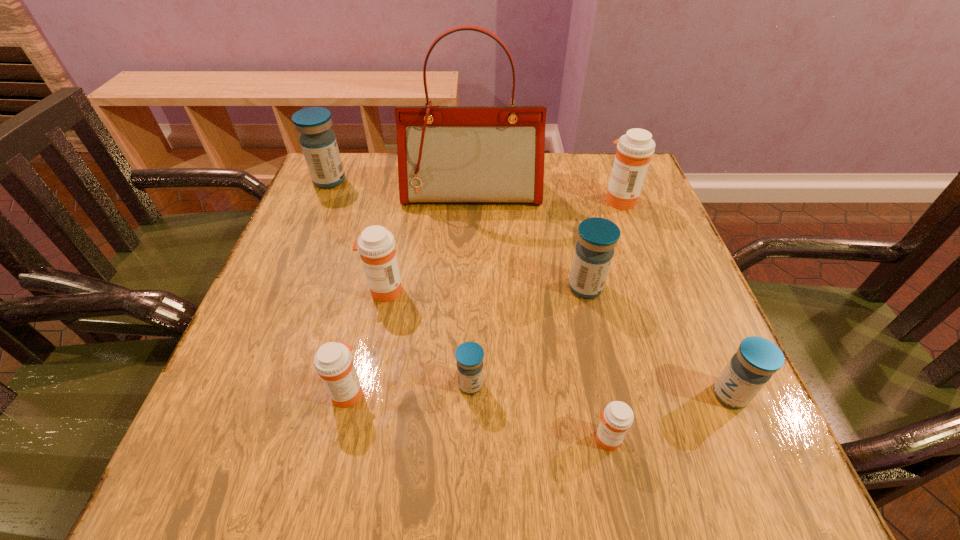
You are a GUI agent. You are given a task and a screenshot of the screen. Output one action in this format:
    pyautogui.click(x=<x>, y=<y>)
    Task: Click on the vacant space at the left edge
    This screenshot has width=960, height=540.
    Given the screenshot: What is the action you would take?
    pyautogui.click(x=321, y=254)

You are a GUI agent. You are given a task and a screenshot of the screen. Output one action in this format:
    pyautogui.click(x=<x>, y=<y>)
    Task: Click on the vacant region at the right edge
    Image resolution: width=960 pixels, height=540 pixels.
    Given the screenshot: What is the action you would take?
    pyautogui.click(x=624, y=322)

Locate an element on the screen. Image resolution: width=960 pixels, height=540 pixels. free spot between the rightmost blue medicine and the third biggest orange medicine is located at coordinates (539, 394).

Where is `free spot between the second smallest orange medicine and the leftmost blue medicine`? free spot between the second smallest orange medicine and the leftmost blue medicine is located at coordinates (338, 286).

Find the location of a particular element. The width and height of the screenshot is (960, 540). free area in between the second smallest orange medicine and the leftmost blue medicine is located at coordinates (338, 286).

You are a GUI agent. You are given a task and a screenshot of the screen. Output one action in this format:
    pyautogui.click(x=<x>, y=<y>)
    Task: Click on the free space between the third farthest orange medicine and the pink handbag
    The width and height of the screenshot is (960, 540).
    Given the screenshot: What is the action you would take?
    pyautogui.click(x=410, y=293)

The height and width of the screenshot is (540, 960). Identify the location of unoccupied position between the second smallest blue medicine and the farthest blue medicine. (530, 288).

Image resolution: width=960 pixels, height=540 pixels. I want to click on free space between the second nearest orange medicine and the rightmost orange medicine, so click(484, 296).

Locate an element on the screen. This screenshot has width=960, height=540. vacant space that's between the rightmost orange medicine and the third nearest orange medicine is located at coordinates [502, 245].

Identify which object is located as the fifth nearest to the third nearest blue medicine. Please provide its 2D coordinates. Your answer should be formatted as a tuple, i.e. [(x, y)], where the tuple contains the x and y coordinates of a point satisfying the conditions above.

[(617, 418)]